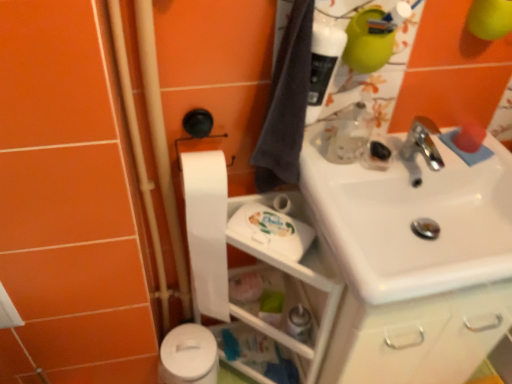
Question: Relative to translucent plastic bottle at upper right, is translucent plastic spray bottle at lower center in front or behind?

Choices:
 (A) behind
 (B) front

Answer: (A)

Question: From the image's perspective, is translucent plastic spray bottle at lower center above or below translucent plastic bottle at upper right?

Choices:
 (A) below
 (B) above

Answer: (A)

Question: Considering the real-world distances, which object is farthest from the translucent plastic bottle at upper right?

Choices:
 (A) translucent plastic spray bottle at lower center
 (B) white plastic shelf at lower center
 (C) white matte toilet paper at lower left, which is the first toilet paper from bottom to top
 (D) white matte toilet paper at center-left, which is the first toilet paper from top to bottom
 (E) white glossy sink at upper right

Answer: (C)

Question: Based on their relative distances, which object is farther from the white matte toilet paper at center-left, which is the 2th toilet paper from bottom to top?

Choices:
 (A) translucent plastic bottle at upper right
 (B) translucent plastic spray bottle at lower center
 (C) white plastic shelf at lower center
 (D) white glossy sink at upper right
 (E) dark gray fabric bath towel at upper right

Answer: (D)